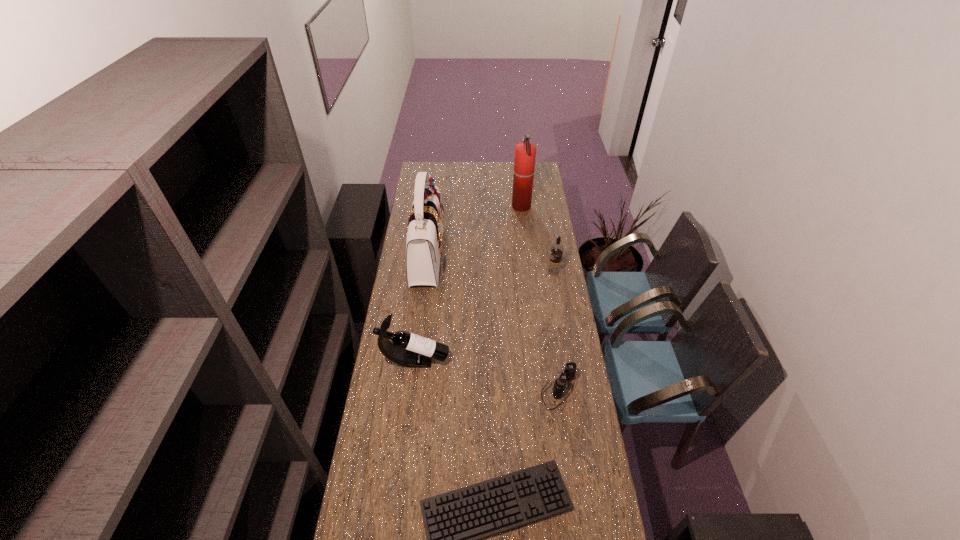
Image resolution: width=960 pixels, height=540 pixels. Find the location of `fire extinguisher`. fire extinguisher is located at coordinates (525, 152).

Where is `satchel`? The height and width of the screenshot is (540, 960). satchel is located at coordinates (424, 234).

Image resolution: width=960 pixels, height=540 pixels. What are the coordinates of `wine bottle` in the screenshot? It's located at (410, 350).

Find the location of a particular element. The image size is (960, 540). the third tallest object is located at coordinates (410, 350).

Identify the location of the fourth tallest object. Image resolution: width=960 pixels, height=540 pixels. point(554,267).

You are a GUI agent. You are given a task and a screenshot of the screen. Output one action in this format:
    pyautogui.click(x=<x>, y=<y>)
    Task: Click on the binoculars
    Image resolution: width=960 pixels, height=540 pixels.
    Given the screenshot: What is the action you would take?
    pyautogui.click(x=569, y=372)

Find the location of a particular element. This screenshot has height=540, width=960. the fifth tallest object is located at coordinates (569, 372).

Find the location of a particular element. The image size is (960, 540). free space located 0.360m with the nozzle and gauge on the fire extinguisher is located at coordinates (451, 207).

This screenshot has width=960, height=540. I want to click on free location located with the nozzle and gauge on the fire extinguisher, so click(x=496, y=207).

Image resolution: width=960 pixels, height=540 pixels. Identify the location of free space located with the nozzle and gauge on the fire extinguisher. (480, 207).